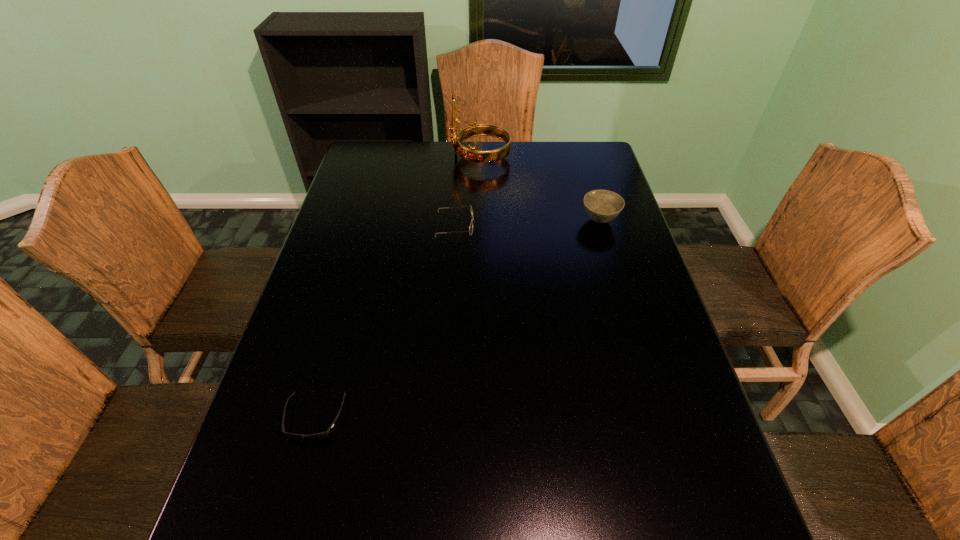
Find the location of a particular element. This screenshot has width=960, height=540. tiara is located at coordinates [473, 130].

The image size is (960, 540). I want to click on the tallest object, so click(473, 130).

Image resolution: width=960 pixels, height=540 pixels. Identify the location of the third shortest object. (602, 206).

At what (x,y) coordinates should I click in order to perform the action: click on the rightmost object. Please return your answer as a coordinate pair (x, y). Looking at the image, I should click on (602, 206).

Where is `spectacles`? spectacles is located at coordinates (470, 231).

Locate an element on the screen. The height and width of the screenshot is (540, 960). sunglasses is located at coordinates point(324,434).

Image resolution: width=960 pixels, height=540 pixels. I want to click on the nearest object, so click(x=324, y=434).

Identify the location of vacant area situated 0.320m on the front-facing side of the tallest object. (363, 157).

Image resolution: width=960 pixels, height=540 pixels. In order to click on free point located 0.180m on the front-facing side of the tallest object in this screenshot , I will do `click(401, 157)`.

Identify the location of free space located 0.270m on the front-facing side of the tallest object. The image size is (960, 540). (376, 157).